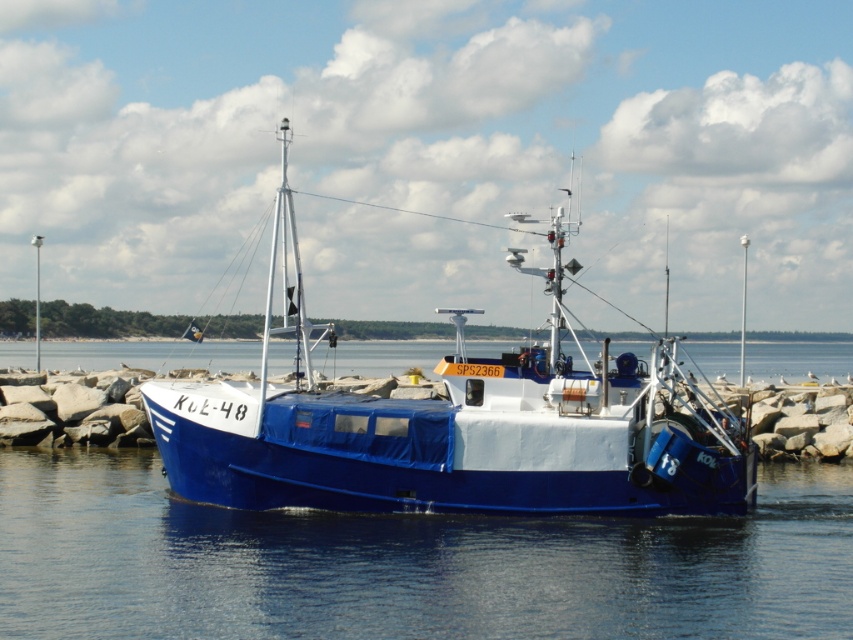
Question: Which of the following is the closest to the observer?

Choices:
 (A) blue smooth water at center
 (B) blue matte boat at center

Answer: (A)

Question: Can you confirm if blue smooth water at center is positioned to the left of blue matte boat at center?

Choices:
 (A) yes
 (B) no

Answer: (A)

Question: Which point is closer to the camera?

Choices:
 (A) (111, 452)
 (B) (363, 465)

Answer: (B)

Question: Is blue smooth water at center closer to the viewer compared to blue matte boat at center?

Choices:
 (A) yes
 (B) no

Answer: (A)

Question: Does blue smooth water at center come in front of blue matte boat at center?

Choices:
 (A) yes
 (B) no

Answer: (A)